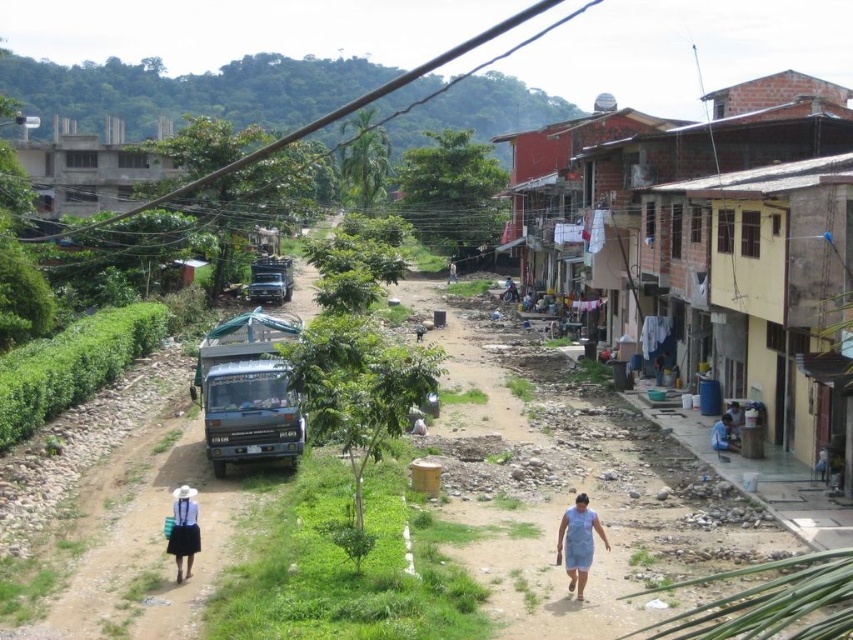
Question: Which object is closer to the camera taking this photo?

Choices:
 (A) light blue fabric at lower right
 (B) blue fabric dress at lower center

Answer: (B)

Question: Is the position of matte white hat at lower left less distant than that of light blue fabric at lower right?

Choices:
 (A) yes
 (B) no

Answer: (A)

Question: Can you confirm if matte white hat at lower left is smaller than white fabric at center?

Choices:
 (A) yes
 (B) no

Answer: (A)

Question: Which of the following is the farthest from the observer?

Choices:
 (A) pos(666,246)
 (B) pos(189,572)
 (C) pos(587,548)
 (D) pos(724,444)

Answer: (A)

Question: Can you confirm if blue matte truck at center is bigger than matte white hat at lower left?

Choices:
 (A) yes
 (B) no

Answer: (A)

Question: Which object is closer to the camera taking this photo?

Choices:
 (A) blue fabric shirt at lower right
 (B) light blue fabric at lower right

Answer: (A)